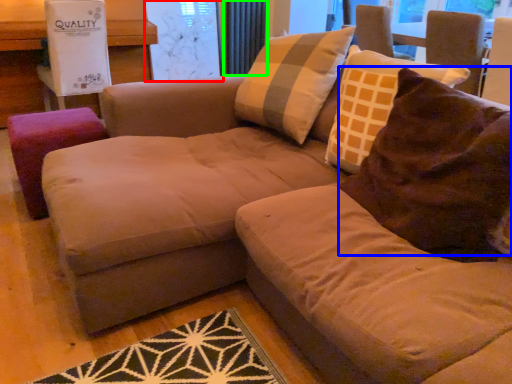
Question: Which object is the farthest from window screen (highlighted by a red box)? Choose among these: throw pillow (highlighted by a blue box) or radiator (highlighted by a green box).

Choices:
 (A) throw pillow
 (B) radiator

Answer: (A)